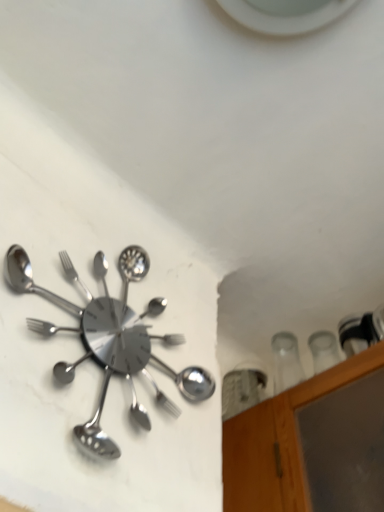
The width and height of the screenshot is (384, 512). Describe the element at coordinates (106, 343) in the screenshot. I see `polished metal clock at upper left` at that location.

At what (x,y) coordinates should I click in order to perform the action: click on polished metal clock at upper left. Please return your answer as a coordinate pair (x, y). The image size is (384, 512). Looking at the image, I should click on (106, 343).

Identify the location of polished metal clock at upper left. Image resolution: width=384 pixels, height=512 pixels. (106, 343).